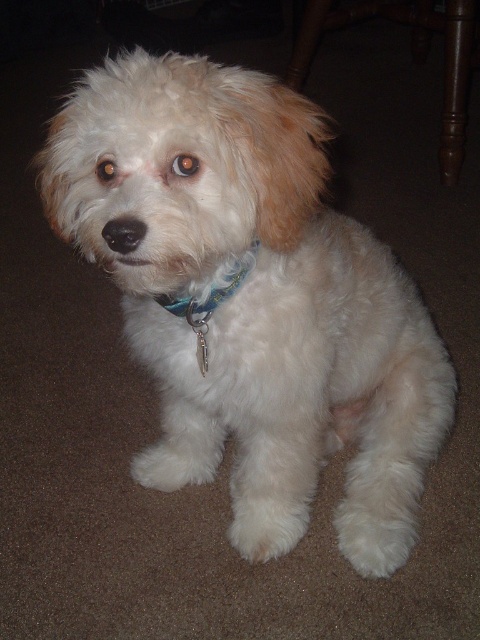
You are a photographer trying to capture the white fluffy dog at center. You need to place a light source at point (252, 300). Will the light source be on the dog?

Yes, the light source placed at point (252, 300) will be on the white fluffy dog at center as the point is located on the dog.

You are standing in the room where the small fluffy dog is located. You notice two points marked on the floor. The first point is at coordinates point (304,456) and the second point is at point (255,252). If you were to walk from the first point to the second point, would you be moving towards the dog or away from it?

Since point (304,456) is behind point (255,252), moving from the first point to the second point would mean moving towards the dog.